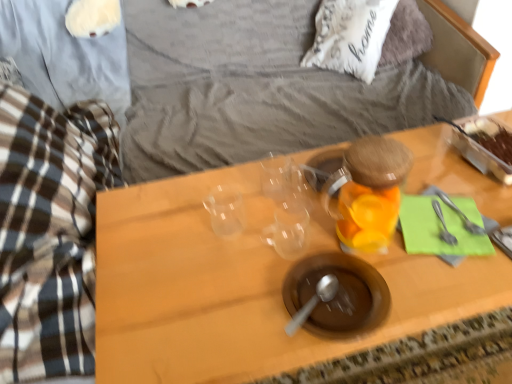
Where is `vacant space to the right of silver metallic fork at right, which is the 1th silverware from right to left`? This screenshot has width=512, height=384. vacant space to the right of silver metallic fork at right, which is the 1th silverware from right to left is located at coordinates (496, 203).